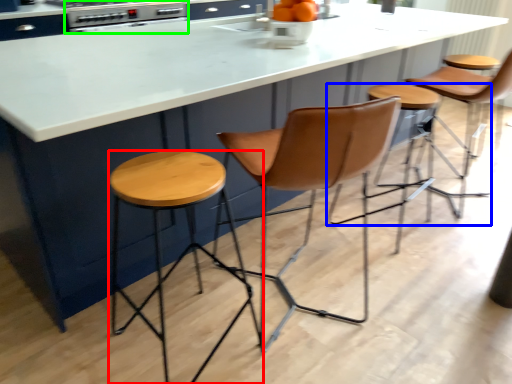
Question: Which object is the farthest from stool (highlighted by a red box)? Choose among these: stool (highlighted by a blue box) or appliance (highlighted by a green box).

Choices:
 (A) stool
 (B) appliance

Answer: (B)